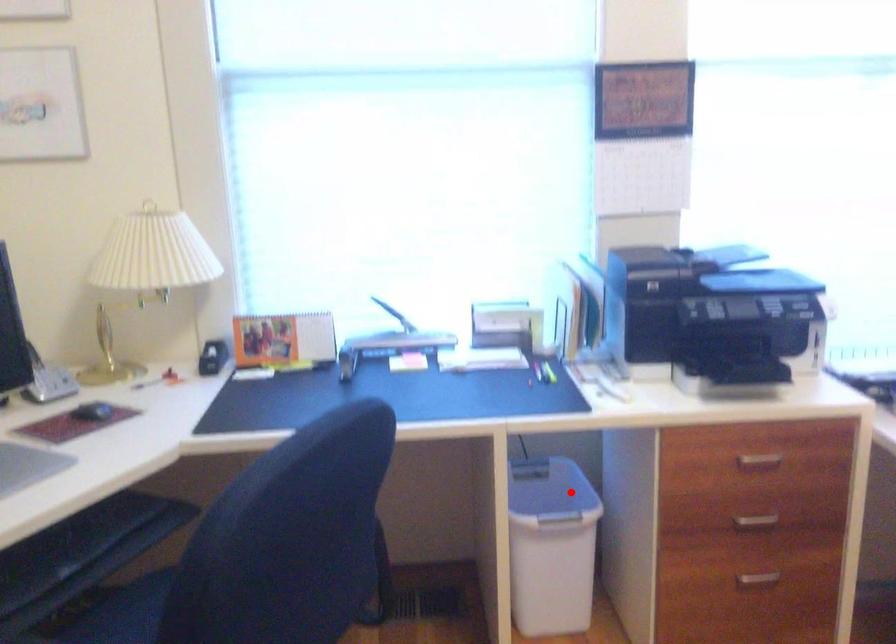
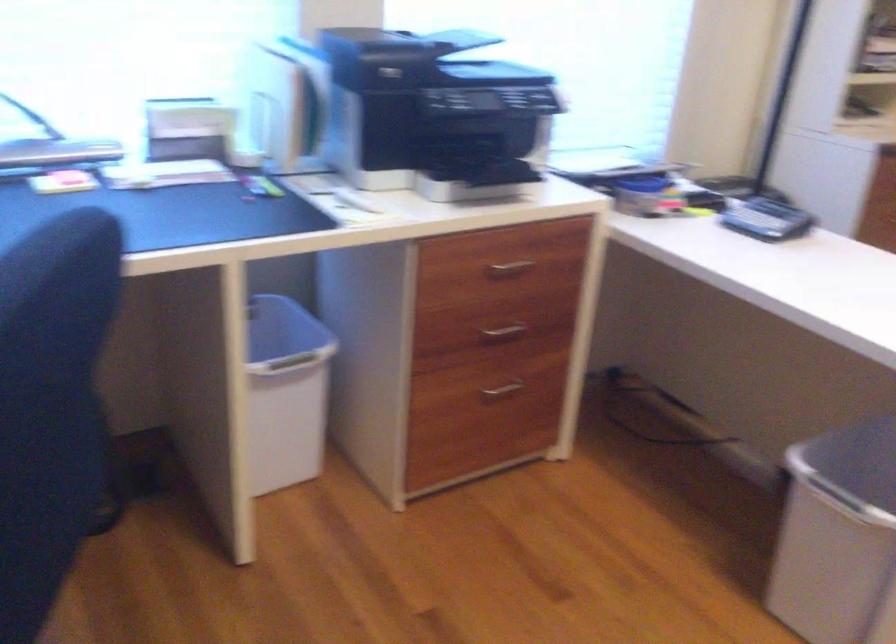
Where in the second image is the point corresponding to the highlighted location from the first image?

(281, 328)